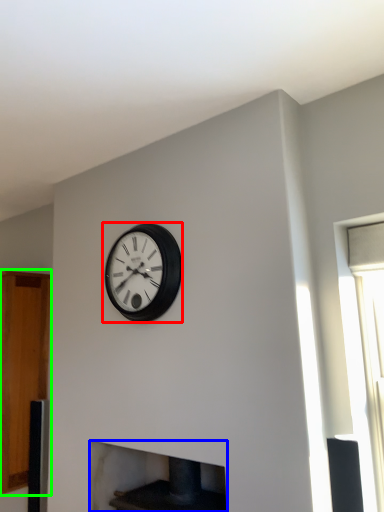
Question: Based on their relative distances, which object is nearer to wall clock (highlighted by a red box)? Choose from fireplace (highlighted by a blue box) and cabinetry (highlighted by a green box).

Choices:
 (A) fireplace
 (B) cabinetry

Answer: (A)